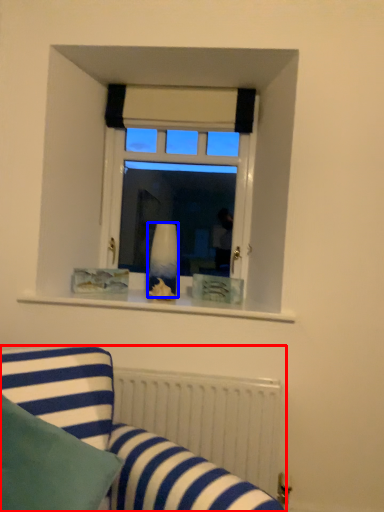
Question: Among these objects, which one is nearest to the camera, studio couch (highlighted by a red box) or vase (highlighted by a blue box)?

Choices:
 (A) studio couch
 (B) vase

Answer: (A)